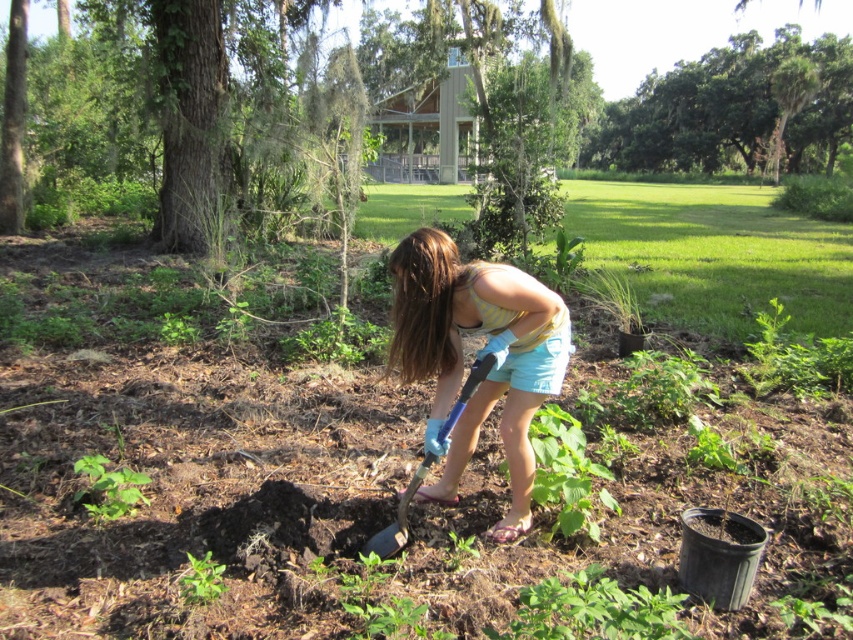
Question: Which object appears closest to the camera in this image?

Choices:
 (A) matte blue gloves at center
 (B) green leafy tree at upper center
 (C) blue plastic shovel at center

Answer: (A)

Question: Does green leafy tree at upper center have a greater width compared to blue plastic shovel at center?

Choices:
 (A) yes
 (B) no

Answer: (A)

Question: Which point is closer to the camera?

Choices:
 (A) (527, 372)
 (B) (827, 113)
 (C) (209, 572)

Answer: (C)

Question: Which of the following is the farthest from the observer?

Choices:
 (A) (520, 470)
 (B) (583, 154)
 (C) (195, 557)

Answer: (B)

Question: Does green leafy tree at upper center come behind green leafy weed at lower left?

Choices:
 (A) yes
 (B) no

Answer: (A)

Question: Does green leafy tree at upper center appear over blue plastic shovel at center?

Choices:
 (A) no
 (B) yes

Answer: (B)